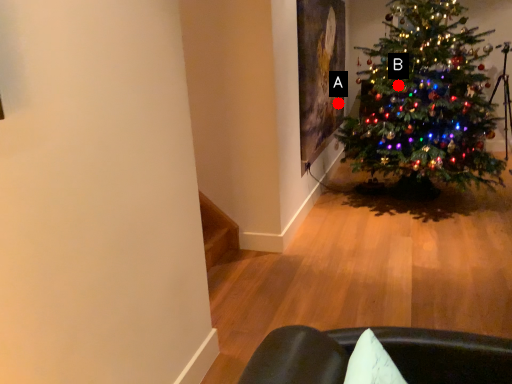
Question: Two points are circled on the image, labeled by A and B beside each circle. Which point is closer to the camera?

Choices:
 (A) A is closer
 (B) B is closer

Answer: (B)